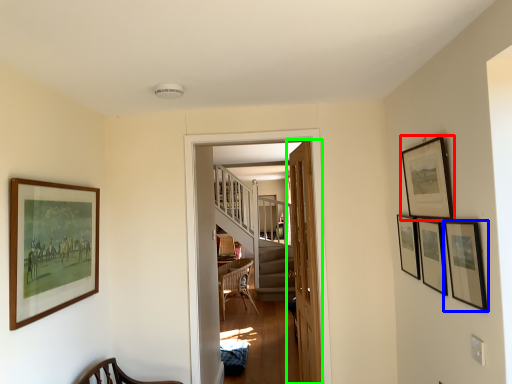
Question: Based on their relative distances, which object is nearer to picture frame (highlighted by a red box)? Choose from picture frame (highlighted by a blue box) and door (highlighted by a green box).

Choices:
 (A) picture frame
 (B) door

Answer: (A)